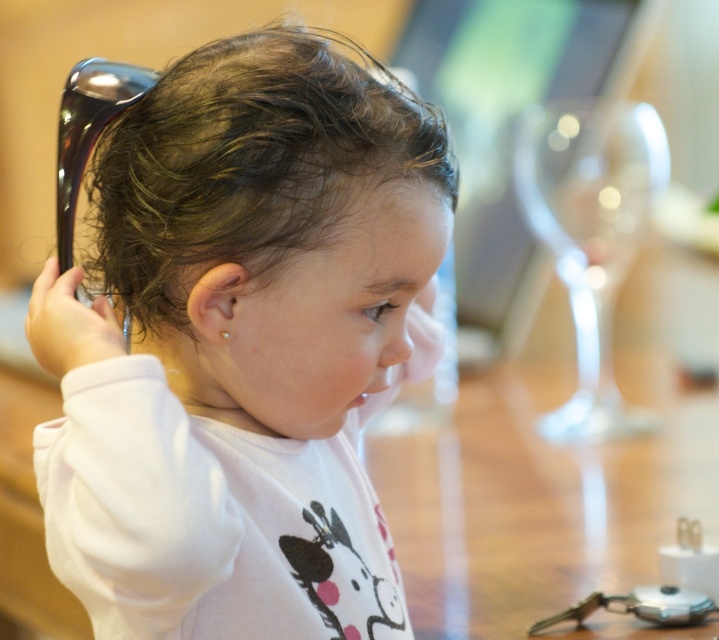
Question: Does white matte toddler at center appear on the left side of dark brown curly hair at center?

Choices:
 (A) no
 (B) yes

Answer: (A)

Question: Does white matte toddler at center lie behind dark brown curly hair at center?

Choices:
 (A) yes
 (B) no

Answer: (B)

Question: Which object is closer to the camera taking this photo?

Choices:
 (A) dark brown curly hair at center
 (B) white matte toddler at center

Answer: (B)

Question: Which object appears closest to the camera in this image?

Choices:
 (A) white matte toddler at center
 (B) dark brown curly hair at center

Answer: (A)

Question: Which point is closer to the camera taking this photo?

Choices:
 (A) (111, 604)
 (B) (150, 316)

Answer: (A)

Question: Observing the image, what is the correct spatial positioning of white matte toddler at center in reference to dark brown curly hair at center?

Choices:
 (A) left
 (B) right

Answer: (B)